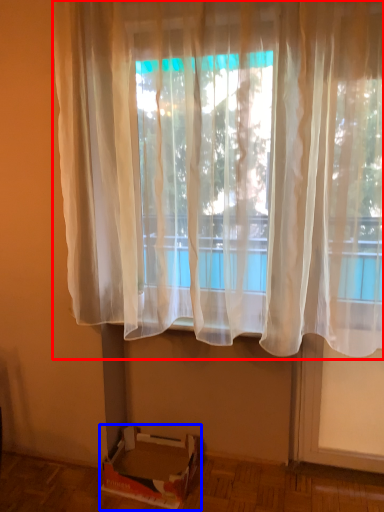
Question: Which point is closer to the camera, curtain (highlighted by a red box) or cardboard box (highlighted by a blue box)?

Choices:
 (A) curtain
 (B) cardboard box

Answer: (A)